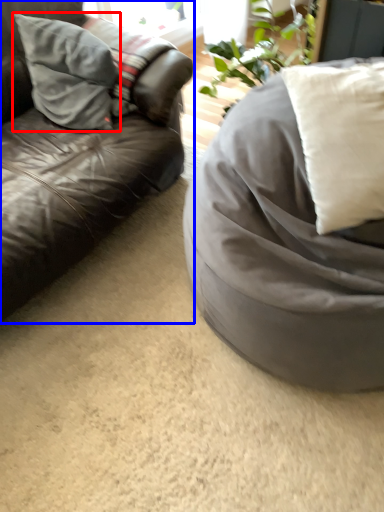
Question: Which object is closer to the camera taking this photo, pillow (highlighted by a red box) or studio couch (highlighted by a blue box)?

Choices:
 (A) pillow
 (B) studio couch

Answer: (B)